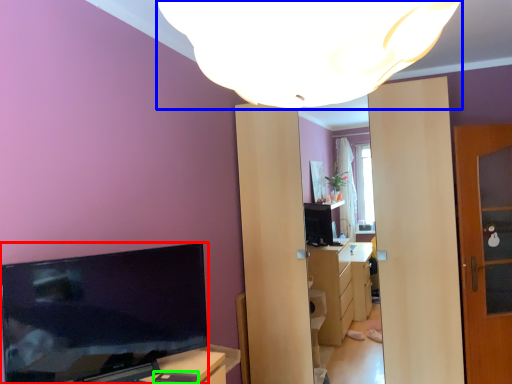
Question: Estimate the real-world distances between objects in this image. Which object is closer to television (highlighted by a red box), lamp (highlighted by a blue box) or mobile phone (highlighted by a green box)?

Choices:
 (A) lamp
 (B) mobile phone

Answer: (B)